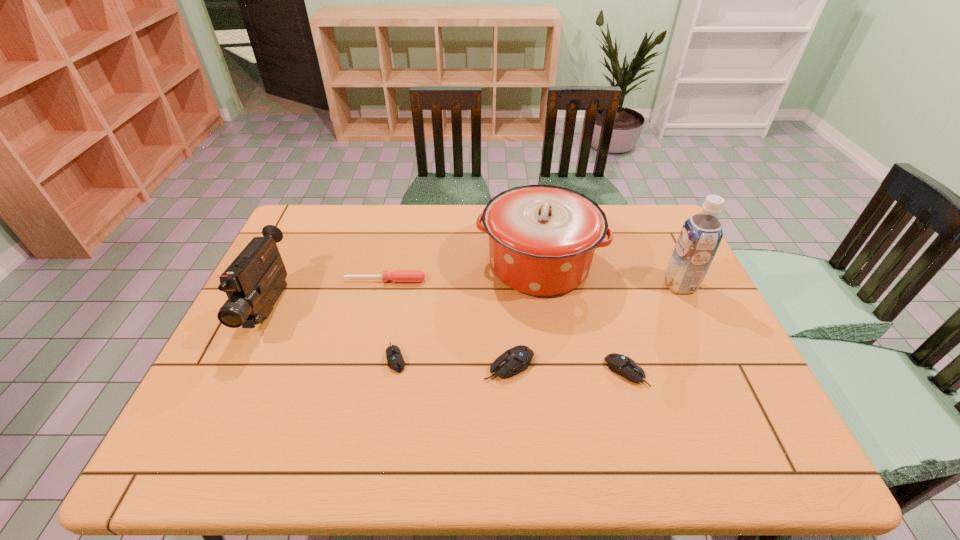
Locate an element on the screen. The height and width of the screenshot is (540, 960). vacant space that satisfies the following two spatial constraints: 1. on the back side of the screwdriver; 2. on the left side of the casserole is located at coordinates (389, 265).

This screenshot has height=540, width=960. Identify the location of vacant position in the image that satisfies the following two spatial constraints: 1. on the label of the soya milk; 2. on the front-facing side of the camcorder. (691, 308).

Where is `vacant space that satisfies the following two spatial constraints: 1. on the front-facing side of the second computer mouse from left to right; 2. on the right side of the camcorder`? This screenshot has width=960, height=540. vacant space that satisfies the following two spatial constraints: 1. on the front-facing side of the second computer mouse from left to right; 2. on the right side of the camcorder is located at coordinates [x=242, y=365].

Find the location of a particular element. Image resolution: width=960 pixels, height=540 pixels. vacant position in the image that satisfies the following two spatial constraints: 1. on the front-facing side of the leftmost object; 2. on the right side of the tallest computer mouse is located at coordinates (242, 365).